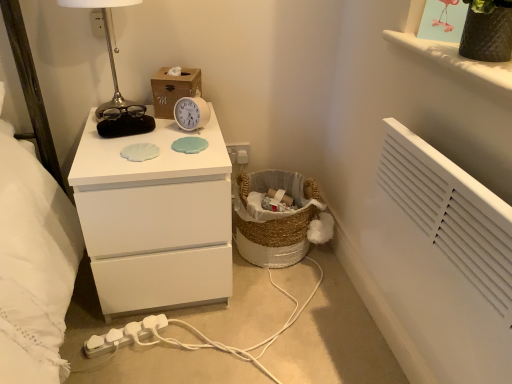
Question: Is textured brown vase at upper right looking in the opposite direction of white matte chest of drawers at center?

Choices:
 (A) yes
 (B) no

Answer: (B)

Question: Can you confirm if textured brown vase at upper right is bigger than white matte chest of drawers at center?

Choices:
 (A) no
 (B) yes

Answer: (A)

Question: Is textured brown vase at upper right far from white matte chest of drawers at center?

Choices:
 (A) no
 (B) yes

Answer: (A)

Question: From the image's perspective, is textured brown vase at upper right beneath white matte chest of drawers at center?

Choices:
 (A) no
 (B) yes

Answer: (A)

Question: Is textured brown vase at upper right completely or partially outside of white matte chest of drawers at center?

Choices:
 (A) yes
 (B) no

Answer: (A)

Question: From the image's perspective, is wooden tissue box at upper center above or below white plastic electric outlet at upper center?

Choices:
 (A) above
 (B) below

Answer: (B)

Question: From a real-world perspective, is wooden tissue box at upper center physically located above or below white plastic electric outlet at upper center?

Choices:
 (A) below
 (B) above

Answer: (A)

Question: Considering the positions of wooden tissue box at upper center and white plastic electric outlet at upper center in the image, is wooden tissue box at upper center bigger or smaller than white plastic electric outlet at upper center?

Choices:
 (A) small
 (B) big

Answer: (B)

Question: In terms of height, does wooden tissue box at upper center look taller or shorter compared to white plastic electric outlet at upper center?

Choices:
 (A) tall
 (B) short

Answer: (A)

Question: Is metallic silver table lamp at upper left spatially inside white plastic electric outlet at upper center, or outside of it?

Choices:
 (A) inside
 (B) outside

Answer: (B)

Question: In terms of width, does metallic silver table lamp at upper left look wider or thinner when compared to white plastic electric outlet at upper center?

Choices:
 (A) thin
 (B) wide

Answer: (B)

Question: Considering the relative positions of metallic silver table lamp at upper left and white plastic electric outlet at upper center in the image provided, is metallic silver table lamp at upper left to the left or to the right of white plastic electric outlet at upper center?

Choices:
 (A) right
 (B) left

Answer: (A)

Question: Looking at the image, does metallic silver table lamp at upper left seem bigger or smaller compared to white plastic electric outlet at upper center?

Choices:
 (A) small
 (B) big

Answer: (B)

Question: From the image's perspective, is textured brown vase at upper right above or below white plastic electric outlet at upper center?

Choices:
 (A) above
 (B) below

Answer: (B)

Question: Considering the positions of textured brown vase at upper right and white plastic electric outlet at upper center in the image, is textured brown vase at upper right bigger or smaller than white plastic electric outlet at upper center?

Choices:
 (A) small
 (B) big

Answer: (B)